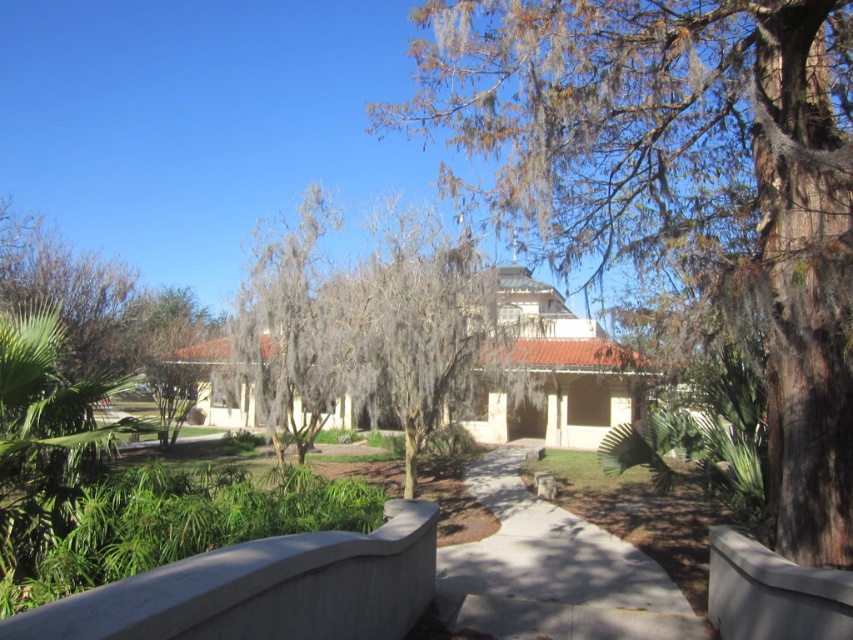
Question: Based on their relative distances, which object is farther from the gray/leathery tree at center?

Choices:
 (A) brown textured tree at upper center
 (B) gray mossy tree at center
 (C) gray concrete pavement at center

Answer: (C)

Question: Among these points, which one is nearest to the camera?

Choices:
 (A) (514, 484)
 (B) (265, 416)

Answer: (B)

Question: In this image, where is gray/leathery tree at center located relative to gray mossy tree at center?

Choices:
 (A) below
 (B) above

Answer: (A)

Question: Is the position of gray/leathery tree at center less distant than that of gray mossy tree at center?

Choices:
 (A) yes
 (B) no

Answer: (A)

Question: Is brown textured tree at upper center further to camera compared to gray concrete pavement at center?

Choices:
 (A) no
 (B) yes

Answer: (A)

Question: Which object is positioned farthest from the gray concrete pavement at center?

Choices:
 (A) gray/leathery tree at center
 (B) gray mossy tree at center

Answer: (B)